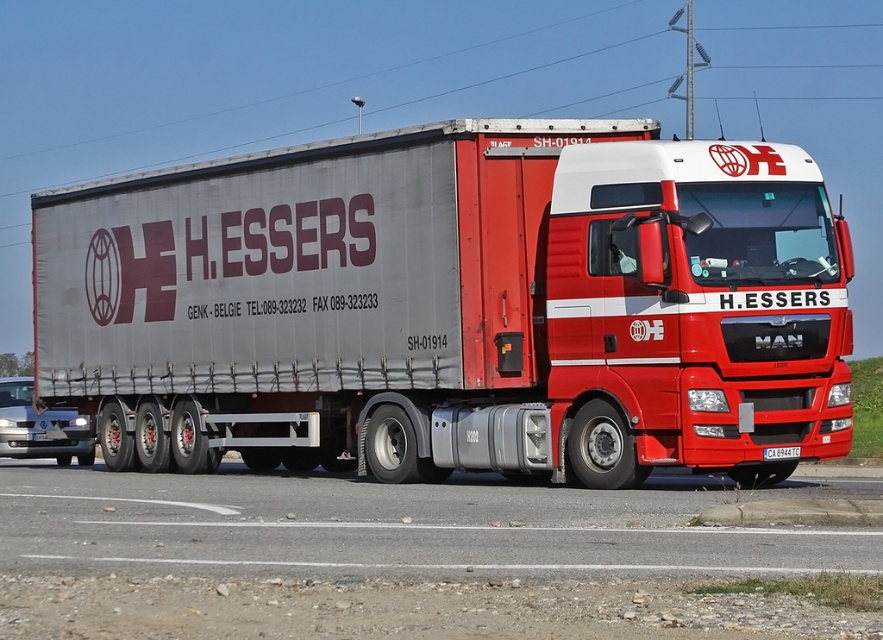
You are a photographer trying to capture the entire metallic silver trailer truck at center in your shot. However, you notice the black plastic license plate at center might be blocking part of the truck. Based on their sizes, do you think the license plate will cover a significant portion of the truck?

The metallic silver trailer truck at center is larger than the black plastic license plate at center, so the license plate will not cover a significant portion of the truck.

You are a delivery driver who needs to park your truck on a road. You want to ensure that the distance between the gray asphalt road at lower center and the black plastic license plate at center is exactly 4.15 meters. Can you confirm if the current parking position meets this requirement?

The gray asphalt road at lower center and the black plastic license plate at center are 4.15 meters apart from each other, so yes, the current parking position meets the requirement of exactly 4.15 meters between them.